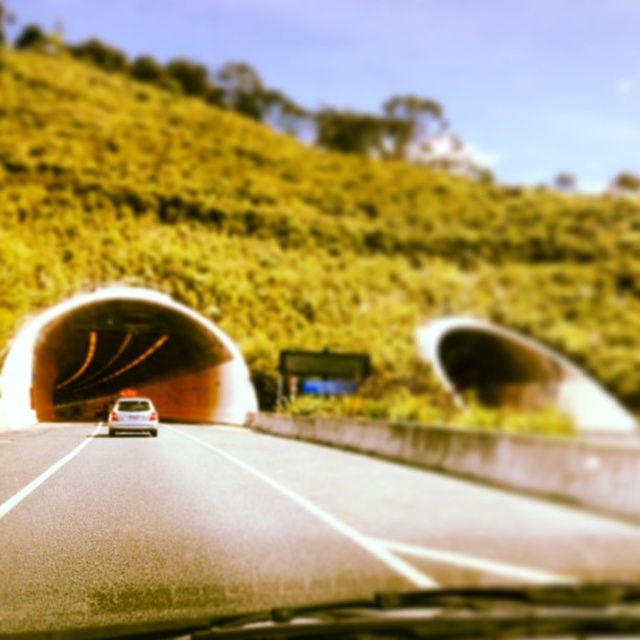
From the picture: Which of these two, green grassy hillside at upper center or gray asphalt road at center, stands taller?

With more height is green grassy hillside at upper center.

Where is `green grassy hillside at upper center`? The width and height of the screenshot is (640, 640). green grassy hillside at upper center is located at coordinates point(291,225).

Locate an element on the screen. green grassy hillside at upper center is located at coordinates (291, 225).

The image size is (640, 640). Find the location of `gray asphalt road at center`. gray asphalt road at center is located at coordinates (259, 528).

Does point (385, 522) lie in front of point (109, 416)?

Yes.

Is point (348, 547) positioned behind point (109, 413)?

No, (348, 547) is in front of (109, 413).

At what (x,y) coordinates should I click in order to perform the action: click on gray asphalt road at center. Please return your answer as a coordinate pair (x, y). The height and width of the screenshot is (640, 640). Looking at the image, I should click on (259, 528).

Is green grassy hillside at upper center to the right of white matte car at center from the viewer's perspective?

Yes, green grassy hillside at upper center is to the right of white matte car at center.

Does green grassy hillside at upper center appear on the left side of white matte car at center?

In fact, green grassy hillside at upper center is to the right of white matte car at center.

Is point (570, 301) more distant than point (145, 397)?

Yes, it is behind point (145, 397).

Image resolution: width=640 pixels, height=640 pixels. In order to click on green grassy hillside at upper center in this screenshot , I will do `click(291, 225)`.